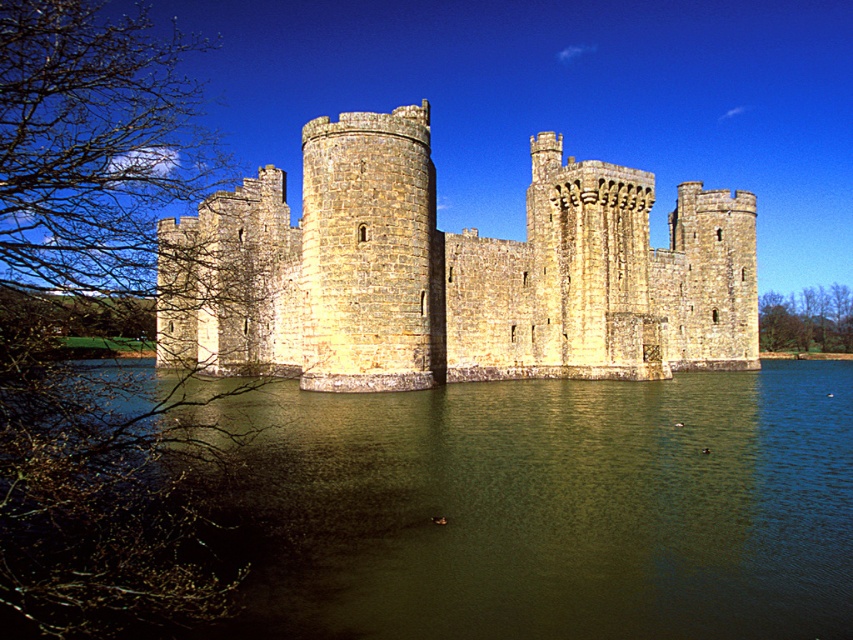
Question: Can you confirm if greenish water at center is thinner than stone castle at center?

Choices:
 (A) no
 (B) yes

Answer: (B)

Question: Is greenish water at center to the right of stone castle at center from the viewer's perspective?

Choices:
 (A) yes
 (B) no

Answer: (B)

Question: Is greenish water at center above stone castle at center?

Choices:
 (A) yes
 (B) no

Answer: (B)

Question: Among these points, which one is nearest to the camera?

Choices:
 (A) (621, 541)
 (B) (293, 241)

Answer: (A)

Question: Which of the following is the farthest from the observer?

Choices:
 (A) (532, 497)
 (B) (167, 333)

Answer: (B)

Question: Which point is closer to the camera?

Choices:
 (A) (374, 118)
 (B) (323, 538)

Answer: (B)